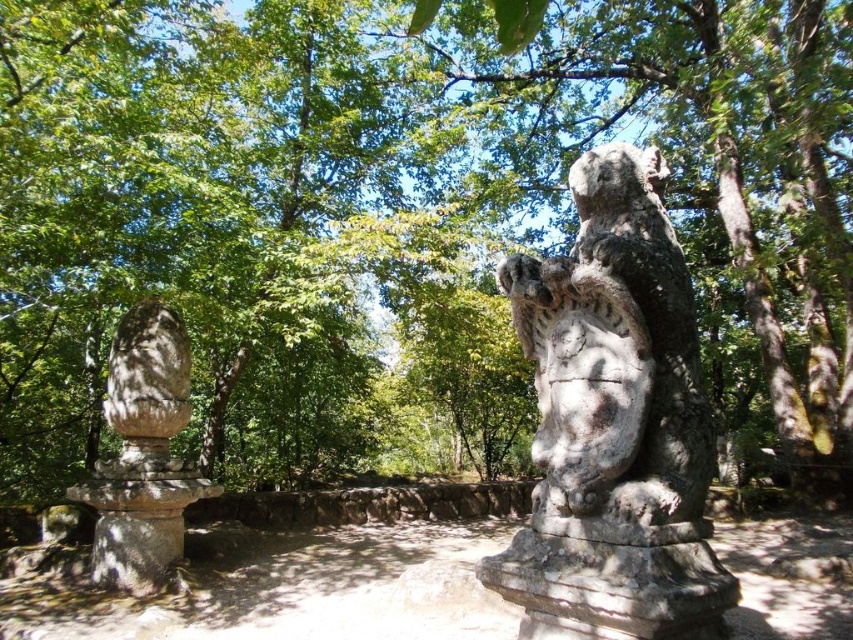
Is weathered stone owl at upper right shorter than rough stone statue at left?

Yes, weathered stone owl at upper right is shorter than rough stone statue at left.

Who is higher up, weathered stone owl at upper right or rough stone statue at left?

weathered stone owl at upper right is above.

Between point (631, 156) and point (175, 534), which one is positioned in front?

Point (631, 156)

Where is `weathered stone owl at upper right`? The height and width of the screenshot is (640, 853). weathered stone owl at upper right is located at coordinates (614, 424).